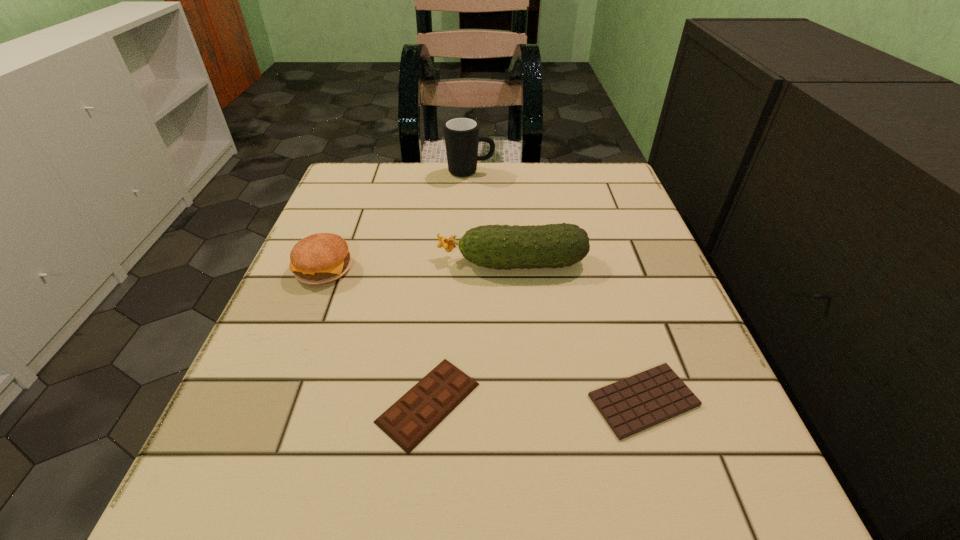
Identify the location of empty space between the hamburger and the farthest object. (397, 220).

Identify the location of vacant point located between the second shortest object and the fourth shortest object. The width and height of the screenshot is (960, 540). (470, 332).

Identify the location of vacant space that is in between the shorter chocolate bar and the second shortest object. (536, 401).

Identify the location of unoccupied area between the cucumber and the left chocolate bar. Image resolution: width=960 pixels, height=540 pixels. (470, 332).

Identify the location of vacant area that lies between the left chocolate bar and the hamburger. (376, 335).

Where is `free space between the farthest object and the left chocolate bar`? The width and height of the screenshot is (960, 540). free space between the farthest object and the left chocolate bar is located at coordinates (449, 287).

The image size is (960, 540). I want to click on free spot between the fourth tallest object and the fourth shortest object, so click(x=470, y=332).

Locate which object ranks second in proximity to the shorter chocolate bar. Please provide its 2D coordinates. Your answer should be formatted as a tuple, i.e. [(x, y)], where the tuple contains the x and y coordinates of a point satisfying the conditions above.

[(506, 247)]

I want to click on object that stands as the third closest to the fourth shortest object, so click(631, 405).

At what (x,y) coordinates should I click in order to perform the action: click on free space in the image that satisfies the following two spatial constraints: 1. on the front side of the third shortest object; 2. on the right side of the taller chocolate bar. Please return your answer as a coordinate pair (x, y). Looking at the image, I should click on (270, 402).